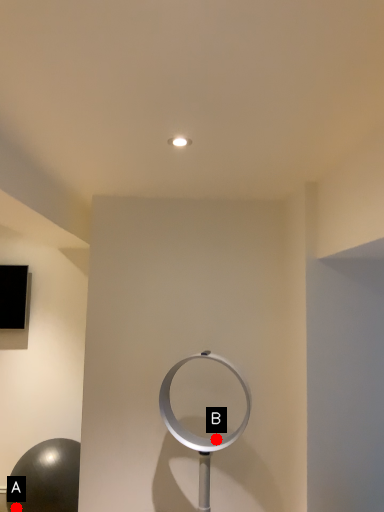
Question: Two points are circled on the image, labeled by A and B beside each circle. Among these points, which one is nearest to the camera?

Choices:
 (A) A is closer
 (B) B is closer

Answer: (B)